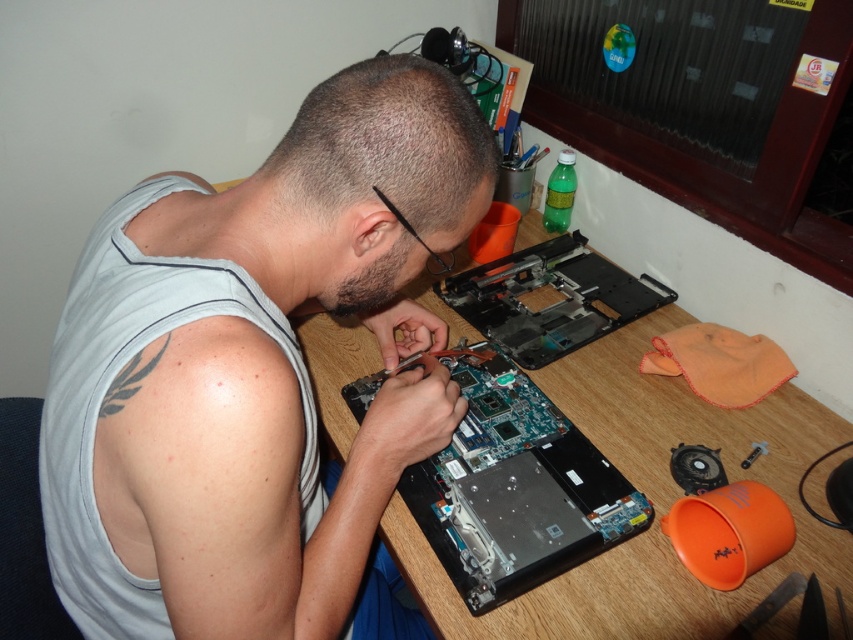
You are a repair technician working on a laptop at a desk. You need to place a new tool on the desk between the gray matte tank top at center and the blue circuit board at center. Based on their positions, which object should you place the tool closer to?

The gray matte tank top at center is to the left of the blue circuit board at center. To place the tool between them, you should position it closer to the gray matte tank top at center since it is on the left side.

You are standing in front of a desk where someone is repairing a laptop. The point at coordinates [527,384] on the desk is where the person is working. If you want to place a tool 1.2 meters away from yourself, will it be closer to the person working on the laptop or farther away?

The point at coordinates [527,384] is 1.06 meters from the viewer. Placing the tool 1.2 meters away would be farther from the person working on the laptop since 1.2 meters is greater than 1.06 meters.

You are a repair technician who needs to place a tool between the gray matte tank top at center and the blue circuit board at center. If the tool is 25 centimeters long, will it fit between them?

The gray matte tank top at center and blue circuit board at center are 24.96 centimeters apart. Since the tool is 25 centimeters long, it will not fit between them as there is insufficient space.